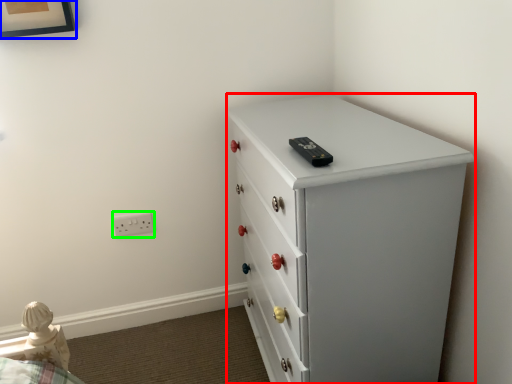
Question: Which object is positioned closest to chest of drawers (highlighted by a red box)? Select from picture frame (highlighted by a blue box) and electric outlet (highlighted by a green box).

Choices:
 (A) picture frame
 (B) electric outlet

Answer: (B)